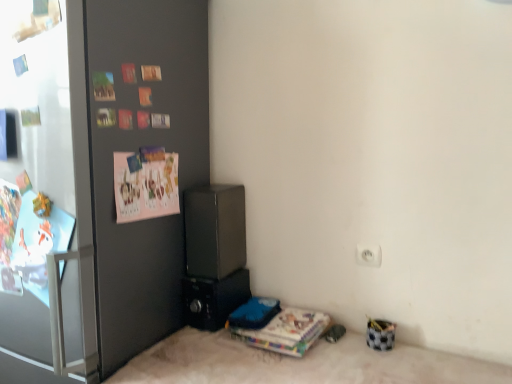
Question: Should I look upward or downward to see transparent glass door at left?

Choices:
 (A) down
 (B) up

Answer: (B)

Question: Considering the relative sizes of white glossy refrigerator at left and satin black speaker at center, the first appliance positioned from the top, in the image provided, is white glossy refrigerator at left shorter than satin black speaker at center, the first appliance positioned from the top,?

Choices:
 (A) no
 (B) yes

Answer: (A)

Question: From the image's perspective, is white glossy refrigerator at left located beneath satin black speaker at center, the first appliance positioned from the top?

Choices:
 (A) yes
 (B) no

Answer: (B)

Question: Is white glossy refrigerator at left behind satin black speaker at center, marked as the second appliance in a bottom-to-top arrangement?

Choices:
 (A) no
 (B) yes

Answer: (A)

Question: Is white glossy refrigerator at left positioned beyond the bounds of satin black speaker at center, marked as the second appliance in a bottom-to-top arrangement?

Choices:
 (A) no
 (B) yes

Answer: (B)

Question: Is the position of white glossy refrigerator at left less distant than that of satin black speaker at center, marked as the second appliance in a bottom-to-top arrangement?

Choices:
 (A) no
 (B) yes

Answer: (B)

Question: Is white glossy refrigerator at left thinner than satin black speaker at center, the first appliance positioned from the top?

Choices:
 (A) yes
 (B) no

Answer: (B)

Question: Is transparent glass door at left not inside satin black speaker at center, the first appliance positioned from the top?

Choices:
 (A) yes
 (B) no

Answer: (A)

Question: Does transparent glass door at left appear on the left side of satin black speaker at center, marked as the second appliance in a bottom-to-top arrangement?

Choices:
 (A) yes
 (B) no

Answer: (A)

Question: Is transparent glass door at left further to the viewer compared to satin black speaker at center, the first appliance positioned from the top?

Choices:
 (A) no
 (B) yes

Answer: (A)

Question: From a real-world perspective, is transparent glass door at left located beneath satin black speaker at center, the first appliance positioned from the top?

Choices:
 (A) yes
 (B) no

Answer: (B)

Question: From the image's perspective, is transparent glass door at left above satin black speaker at center, marked as the second appliance in a bottom-to-top arrangement?

Choices:
 (A) no
 (B) yes

Answer: (B)

Question: Is transparent glass door at left in front of satin black speaker at center, the first appliance positioned from the top?

Choices:
 (A) no
 (B) yes

Answer: (B)

Question: Does white glossy refrigerator at left have a smaller size compared to pink paper postcard at upper left?

Choices:
 (A) no
 (B) yes

Answer: (A)